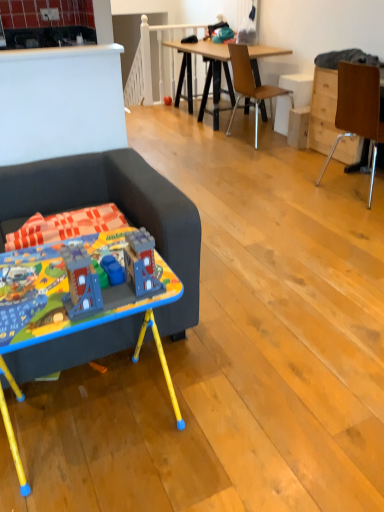
I want to click on free space below wooden chair at right, acting as the 1th chair starting from the front (from a real-world perspective), so click(350, 188).